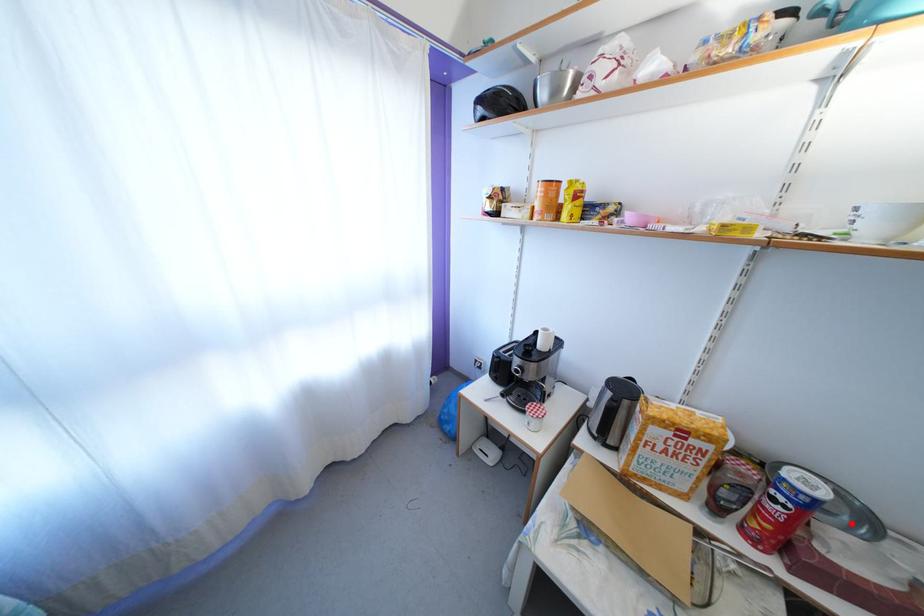
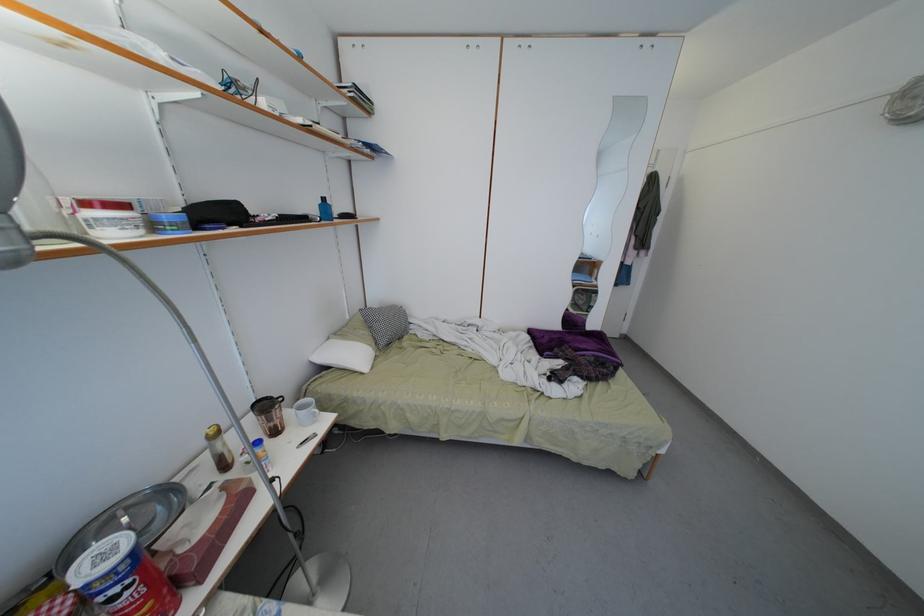
In the second image, find the point that corresponds to the highlighted location in the first image.

(165, 514)